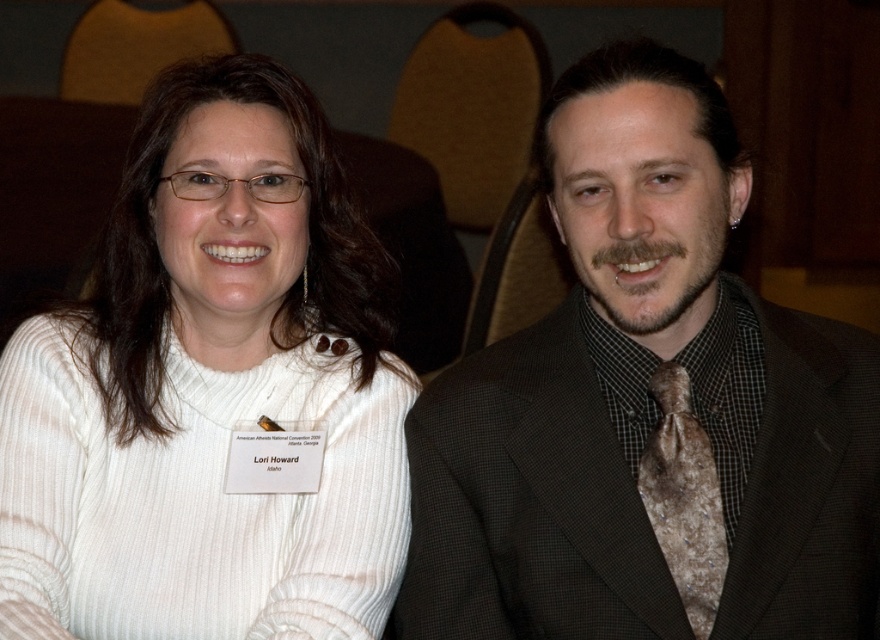
Question: Is white ribbed sweater at left smaller than brown textured tie at right?

Choices:
 (A) no
 (B) yes

Answer: (A)

Question: Which point appears closest to the camera in this image?

Choices:
 (A) (644, 451)
 (B) (576, 509)

Answer: (B)

Question: Which point is closer to the camera?

Choices:
 (A) (546, 131)
 (B) (222, 568)

Answer: (A)

Question: Can you confirm if brown textured suit at center is wider than brown textured tie at right?

Choices:
 (A) yes
 (B) no

Answer: (A)

Question: Among these objects, which one is nearest to the camera?

Choices:
 (A) white ribbed sweater at left
 (B) brown textured tie at right
 (C) brown textured suit at center

Answer: (C)

Question: Where is white ribbed sweater at left located in relation to brown textured tie at right in the image?

Choices:
 (A) left
 (B) right

Answer: (A)